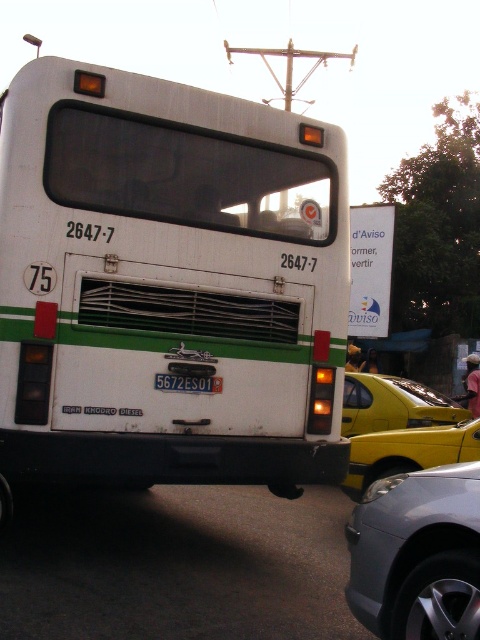
Between satin silver car at lower right and white plastic license plate at center, which one appears on the left side from the viewer's perspective?

white plastic license plate at center is more to the left.

Between point (443, 561) and point (202, 387), which one is positioned behind?

The point (202, 387) is behind.

Identify the location of satin silver car at lower right. (418, 554).

Is the position of white matte bus at center less distant than that of white plastic license plate at center?

Yes, white matte bus at center is closer to the viewer.

How much distance is there between white matte bus at center and white plastic license plate at center?

They are 29.13 inches apart.

Measure the distance between white matte bus at center and camera.

13.72 feet

At what (x,y) coordinates should I click in order to perform the action: click on white matte bus at center. Please return your answer as a coordinate pair (x, y). This screenshot has width=480, height=640. Looking at the image, I should click on (168, 284).

Identify the location of satin silver car at lower right. (418, 554).

Which is in front, point (423, 536) or point (364, 404)?

Positioned in front is point (423, 536).

Which is in front, point (362, 573) or point (383, 385)?

Point (362, 573) is more forward.

Locate an element on the screen. satin silver car at lower right is located at coordinates (418, 554).